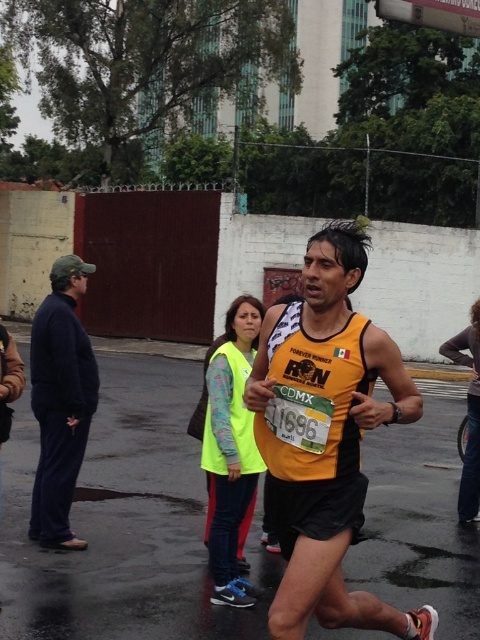
Question: Which of these objects is positioned farthest from the dark blue fleece at left?

Choices:
 (A) yellow fabric tank top at center
 (B) neon yellow vest at center

Answer: (A)

Question: Is yellow fabric tank top at center closer to the viewer compared to dark blue fleece at left?

Choices:
 (A) no
 (B) yes

Answer: (B)

Question: Among these objects, which one is farthest from the camera?

Choices:
 (A) dark blue fleece at left
 (B) neon yellow vest at center

Answer: (A)

Question: Does yellow fabric tank top at center appear under neon yellow vest at center?

Choices:
 (A) no
 (B) yes

Answer: (B)

Question: Is yellow fabric tank top at center behind neon yellow vest at center?

Choices:
 (A) yes
 (B) no

Answer: (B)

Question: Which point is farther from the camera taking this photo?

Choices:
 (A) (227, 604)
 (B) (72, 486)

Answer: (B)